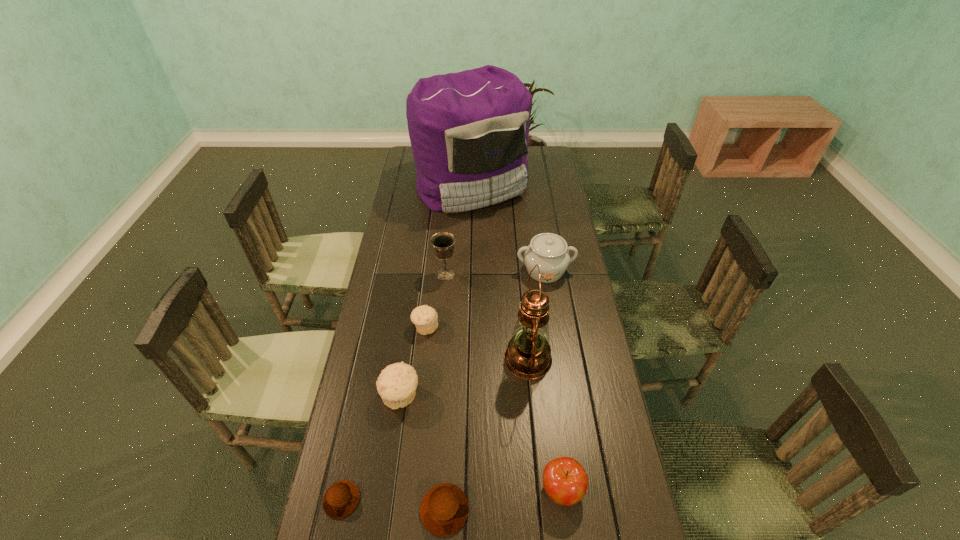
You are a GUI agent. You are given a task and a screenshot of the screen. Output one action in this format:
    pyautogui.click(x=<x>, y=<y>)
    Task: Click on the vacant space located 0.310m on the front of the seventh tallest object
    Image resolution: width=960 pixels, height=540 pixels.
    Given the screenshot: What is the action you would take?
    pyautogui.click(x=415, y=427)

You are a GUI agent. You are given a task and a screenshot of the screen. Output one action in this format:
    pyautogui.click(x=<x>, y=<y>)
    Task: Click on the free spot located 0.200m on the right of the third tallest muffin
    The image size is (960, 540).
    Given the screenshot: What is the action you would take?
    pyautogui.click(x=551, y=510)

Where is `blank area located 0.050m on the back of the smaller brown muffin`? blank area located 0.050m on the back of the smaller brown muffin is located at coordinates (349, 462).

Locate an element on the screen. Image resolution: width=960 pixels, height=540 pixels. object that is at the far edge is located at coordinates (469, 131).

What are the coordinates of `backpack at the left edge` in the screenshot? It's located at (469, 131).

I want to click on backpack that is at the right edge, so click(469, 131).

This screenshot has width=960, height=540. I want to click on oil lamp that is at the right edge, so click(528, 356).

Where is `chinaware located in the right edge section of the desktop`? The height and width of the screenshot is (540, 960). chinaware located in the right edge section of the desktop is located at coordinates (549, 251).

This screenshot has height=540, width=960. What are the coordinates of `apple present at the right edge` in the screenshot? It's located at (565, 481).

You are a GUI agent. You are given a task and a screenshot of the screen. Output one action in this format:
    pyautogui.click(x=<x>, y=<y>)
    Task: Click on the object positioned at the far left corner
    This screenshot has height=540, width=960.
    Given the screenshot: What is the action you would take?
    pyautogui.click(x=469, y=131)